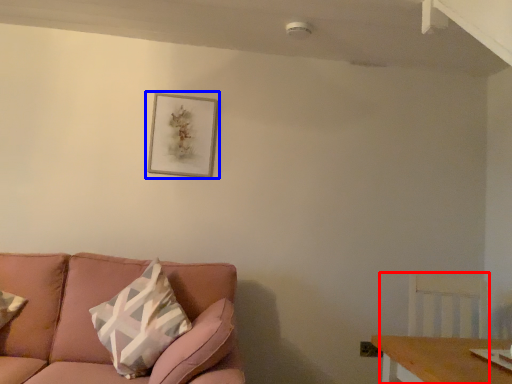
Question: Among these objects, which one is nearest to the camera, swivel chair (highlighted by a red box) or picture frame (highlighted by a blue box)?

Choices:
 (A) swivel chair
 (B) picture frame

Answer: (A)